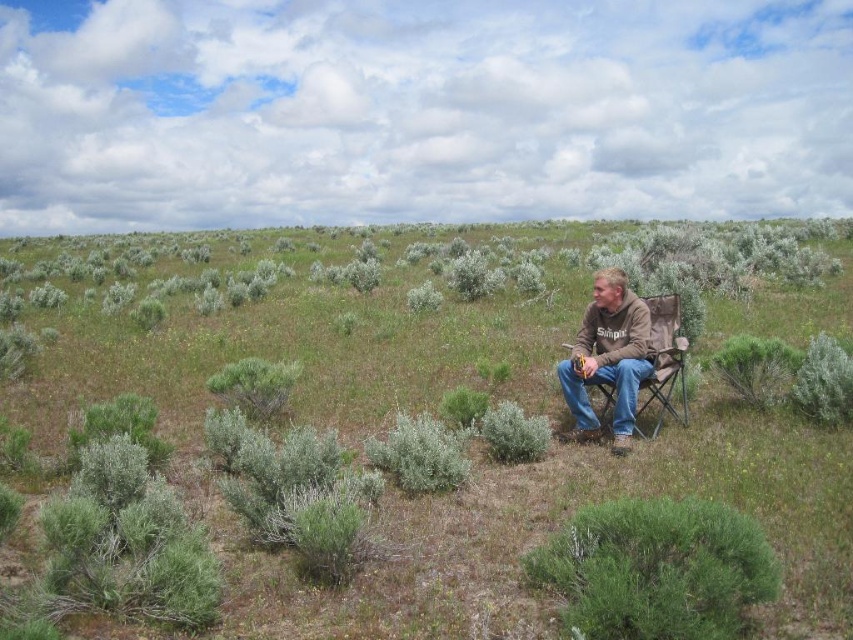
You are a hiker who wants to sit down on the ground near the green fuzzy bush at lower right. However, you notice the brown cotton shirt at center nearby. Which object is closer to the ground?

The green fuzzy bush at lower right is shorter than the brown cotton shirt at center, so the green fuzzy bush at lower right is closer to the ground.